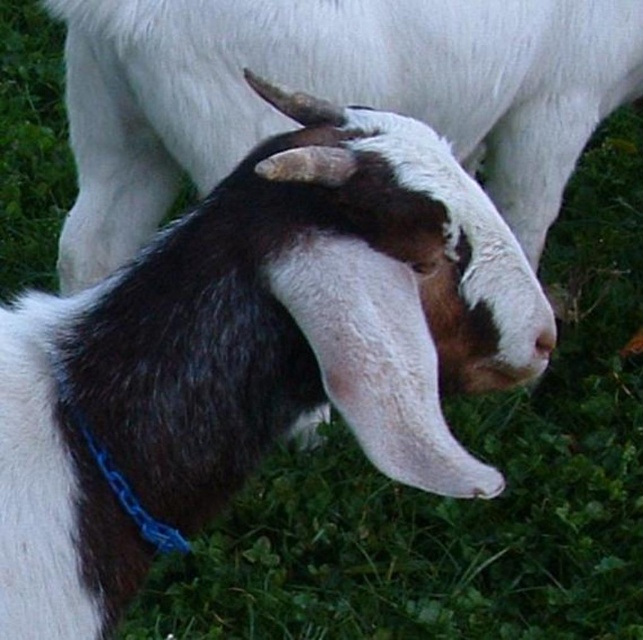
Is blue fabric neckband at center wider than brown matte/goat nose at center?

Indeed, blue fabric neckband at center has a greater width compared to brown matte/goat nose at center.

Looking at this image, between blue fabric neckband at center and brown matte/goat nose at center, which one is positioned lower?

Positioned lower is blue fabric neckband at center.

Describe the element at coordinates (120, 480) in the screenshot. The width and height of the screenshot is (643, 640). I see `blue fabric neckband at center` at that location.

Where is `blue fabric neckband at center`? blue fabric neckband at center is located at coordinates (120, 480).